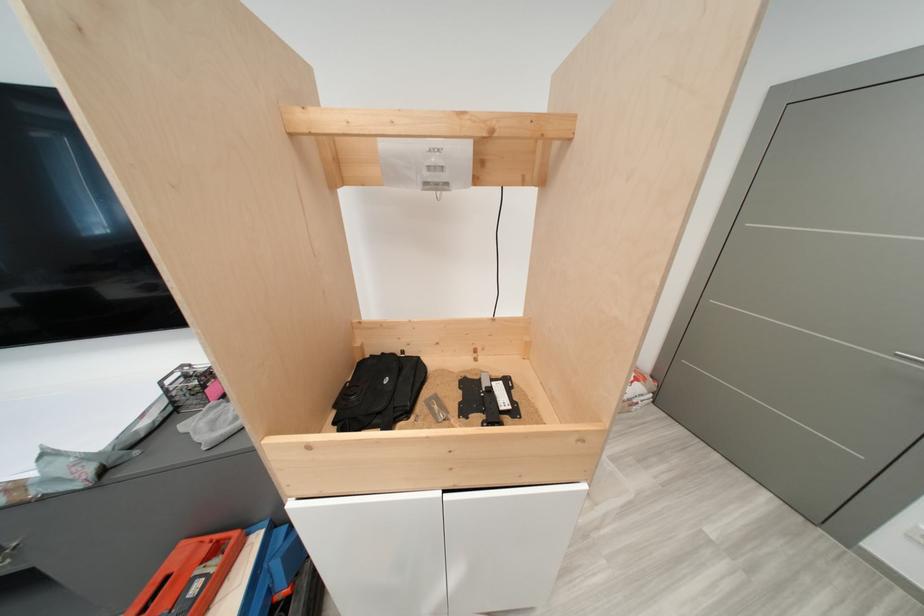
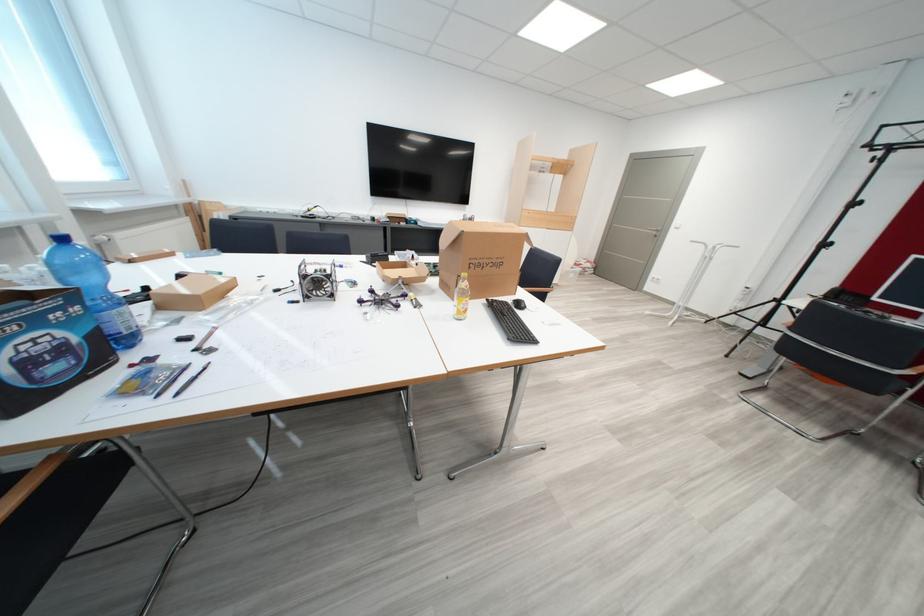
What movement of the cameraman would produce the second image?

The cameraman moved toward left, backward.